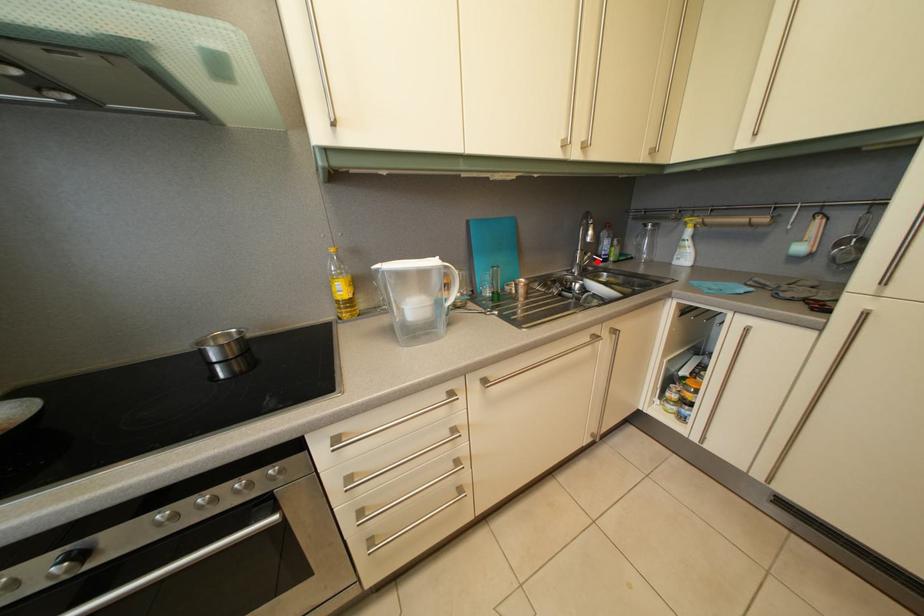
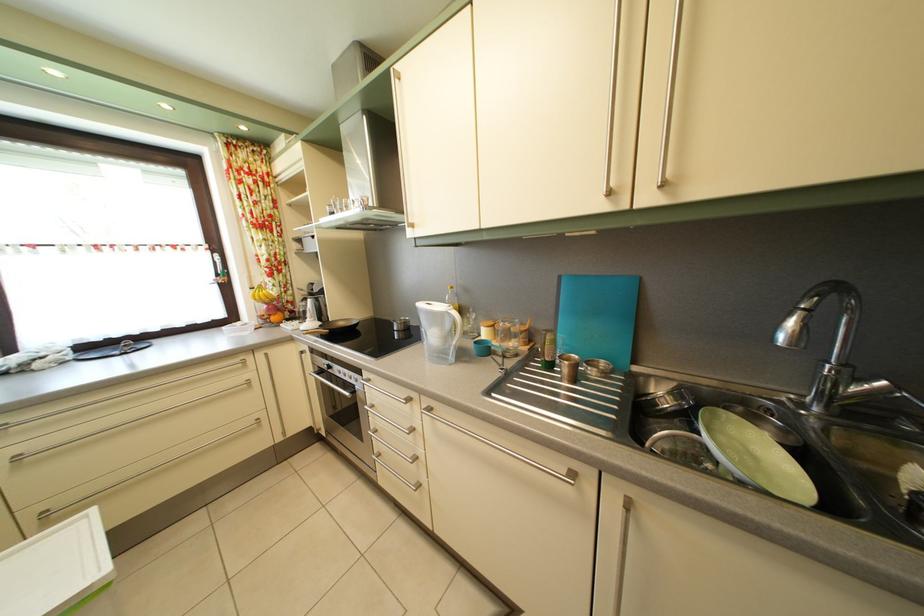
In the second image, find the point that corresponds to the highlighted location in the first image.

(893, 391)